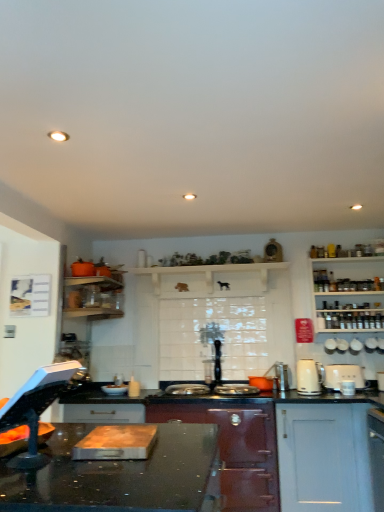
At what (x,y) coordinates should I click in order to perform the action: click on free spot below white glossy kettle at center-right, placed as the 1th kitchen appliance when sorted from left to right (from a real-world perspective). Please return your answer as a coordinate pair (x, y). Image resolution: width=384 pixels, height=512 pixels. Looking at the image, I should click on (321, 393).